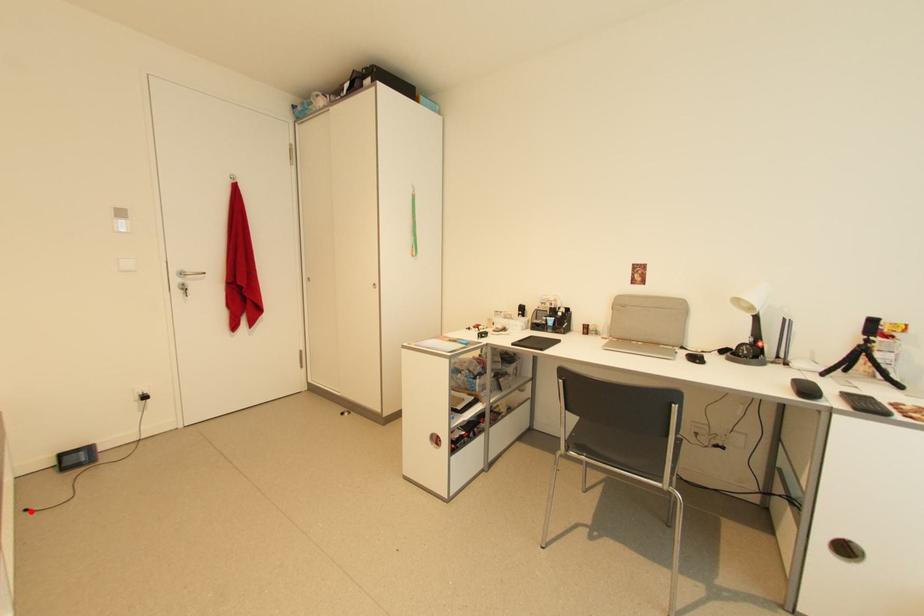
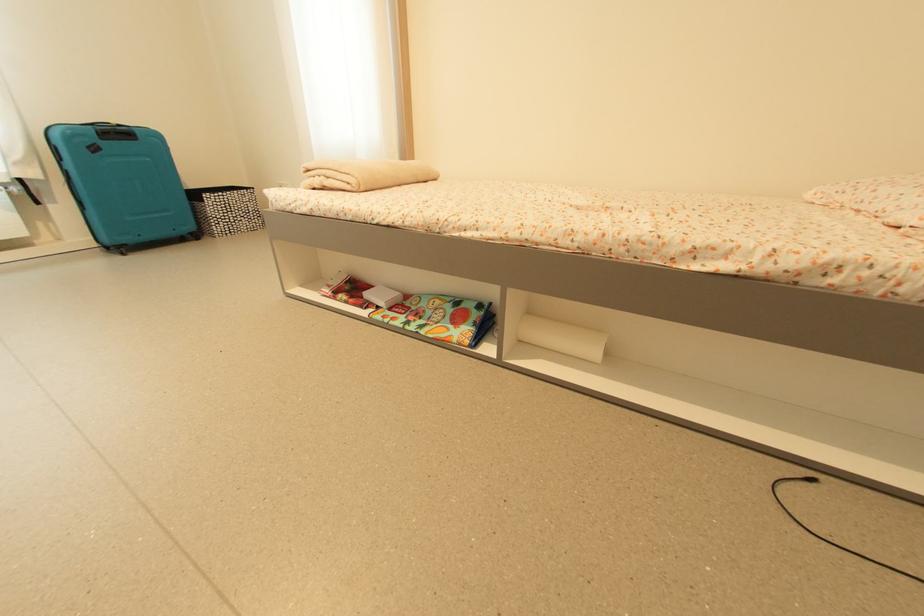
Question: I am providing you with two images of the same scene from different viewpoints. In image1, a red point is highlighted. Considering the same 3D point in image2, which of the following is correct?

Choices:
 (A) It is closer
 (B) It is farther

Answer: (A)